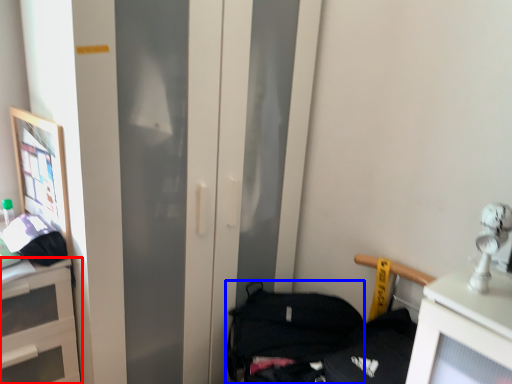
Question: Which of the following is the closest to the observer, cabinetry (highlighted by a red box) or handbag (highlighted by a blue box)?

Choices:
 (A) cabinetry
 (B) handbag

Answer: (A)